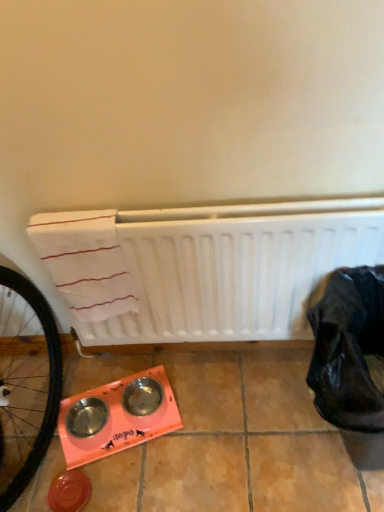
I want to click on empty space that is in between black fabric bag at lower right and white matte radiator at center, so [234, 418].